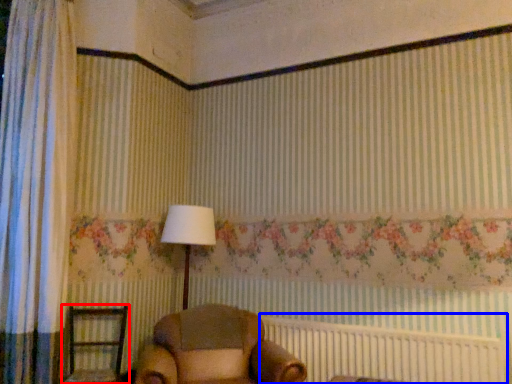
Question: Which point is closer to the camera, furniture (highlighted by a red box) or bed frame (highlighted by a blue box)?

Choices:
 (A) furniture
 (B) bed frame

Answer: (B)